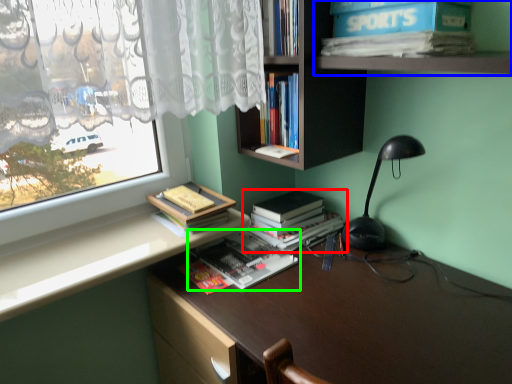
Question: Which is nearer to the book (highlighted by a red box)? shelf (highlighted by a blue box) or book (highlighted by a green box).

Choices:
 (A) shelf
 (B) book

Answer: (B)